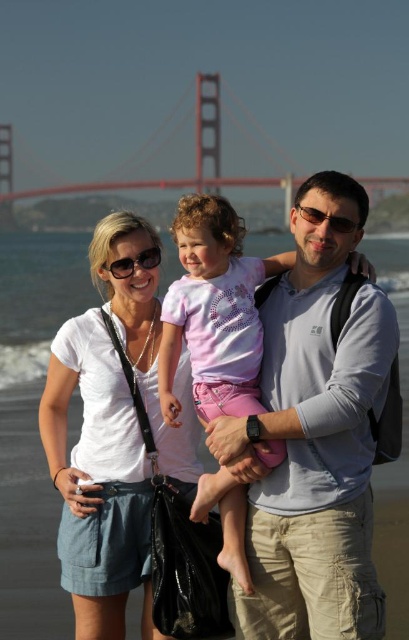
You are a photographer trying to capture a photo of the gray cotton shirt at center and the red painted steel bridge at upper center. Since you want both objects to appear equally large in the photo, which object should you move closer to, and by how much?

The gray cotton shirt at center is narrower than the red painted steel bridge at upper center. To make them appear the same size in the photo, you should move closer to the gray cotton shirt at center because it is smaller in width compared to the bridge. The exact distance adjustment depends on their current distances and sizes, but moving closer to the shirt will proportionally increase its size in the frame relative to the bridge.

You are a photographer trying to capture the Golden Gate Bridge in the background while focusing on the family members. You notice two shirts at the center of the image. Which shirt, the gray cotton shirt at center or the white cotton shirt at center, is closer to the camera?

The gray cotton shirt at center is in front of the white cotton shirt at center, so the gray cotton shirt at center is closer to the camera.

You are a photographer standing at the beach scene with the family. You want to take a photo that includes both the gray cotton shirt at center and the red painted steel bridge at upper center. Given that your camera has a maximum zoom range of 1000 feet, will you be able to capture both objects in a single frame without moving closer?

The gray cotton shirt at center and the red painted steel bridge at upper center are 866.24 feet apart from each other. Since the camera can zoom up to 1000 feet, you can capture both objects in a single frame without moving closer.